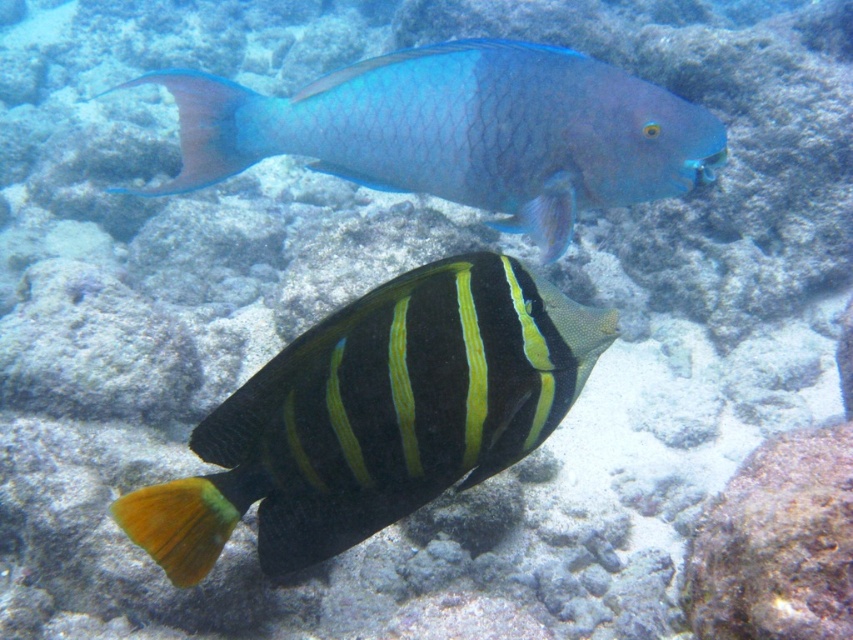
You are a marine biologist observing the underwater scene. You need to determine if the shiny black and yellow fish at center is within the effective range of your underwater camera, which has a maximum focus range of 1 meter. Can you confirm if the fish is within range?

The shiny black and yellow fish at center is 86.81 centimeters away from the viewer, which is within the 1 meter focus range of the underwater camera. Therefore, the fish is within range.

You are a marine biologist observing two fish underwater. You notice the shiny black and yellow fish at center and the shiny blue parrotfish at upper center. Which fish is smaller in height?

The shiny black and yellow fish at center is shorter than the shiny blue parrotfish at upper center, so it is smaller in height.